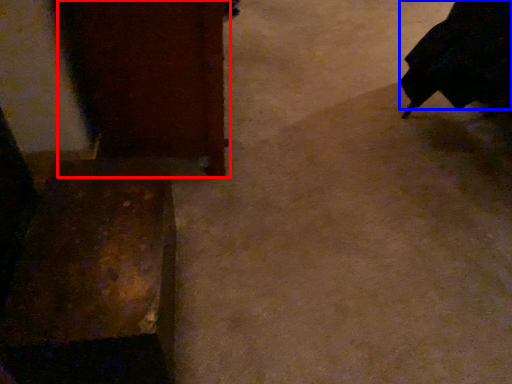
Question: Which of the following is the farthest to the observer, furniture (highlighted by a red box) or robe (highlighted by a blue box)?

Choices:
 (A) furniture
 (B) robe

Answer: (B)